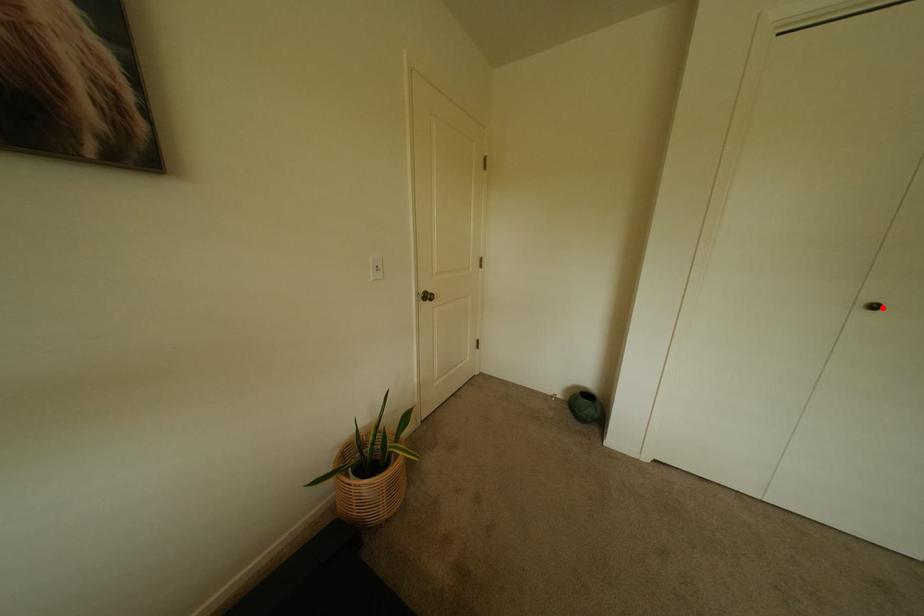
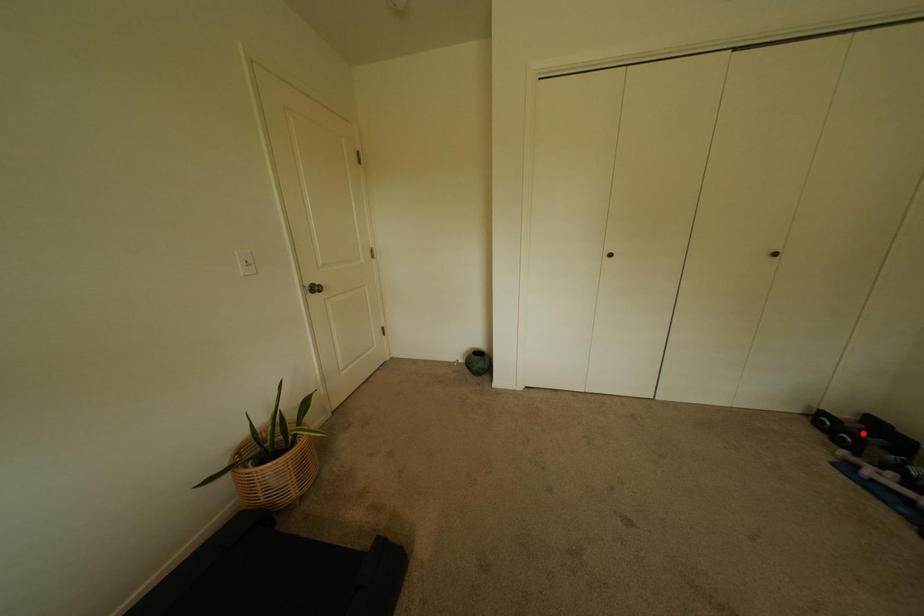
I am providing you with two images of the same scene from different viewpoints. A red point is marked on the first image and another point is marked on the second image. Is the marked point in image1 the same physical position as the marked point in image2?

No